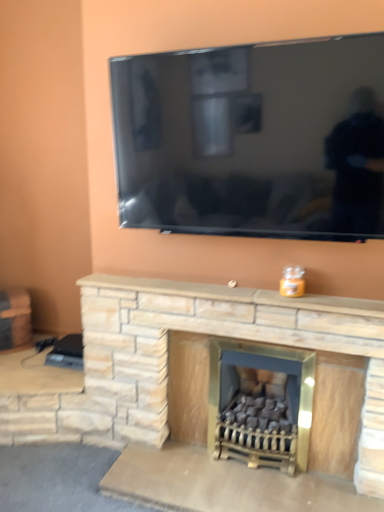
Question: Is brushed metal side table at left far away from natural stone fireplace at center, the 2th fireplace from the right?

Choices:
 (A) yes
 (B) no

Answer: (A)

Question: From the image's perspective, is brushed metal side table at left on top of natural stone fireplace at center, the 2th fireplace from the right?

Choices:
 (A) yes
 (B) no

Answer: (A)

Question: Is the surface of brushed metal side table at left in direct contact with natural stone fireplace at center, the 2th fireplace from the right?

Choices:
 (A) no
 (B) yes

Answer: (A)

Question: Is natural stone fireplace at center, which ranks as the 1th fireplace in left-to-right order, located within brushed metal side table at left?

Choices:
 (A) no
 (B) yes

Answer: (A)

Question: Does brushed metal side table at left have a greater width compared to natural stone fireplace at center, which ranks as the 1th fireplace in left-to-right order?

Choices:
 (A) no
 (B) yes

Answer: (B)

Question: From a real-world perspective, is brushed metal side table at left on top of natural stone fireplace at center, which ranks as the 1th fireplace in left-to-right order?

Choices:
 (A) yes
 (B) no

Answer: (A)

Question: Does natural stone fireplace at center, the 2th fireplace from the right, appear on the right side of matte stone fireplace at center, acting as the second fireplace starting from the left?

Choices:
 (A) yes
 (B) no

Answer: (B)

Question: From a real-world perspective, is natural stone fireplace at center, the 2th fireplace from the right, under matte stone fireplace at center, acting as the second fireplace starting from the left?

Choices:
 (A) yes
 (B) no

Answer: (B)

Question: Is the surface of natural stone fireplace at center, the 2th fireplace from the right, in direct contact with matte stone fireplace at center, acting as the second fireplace starting from the left?

Choices:
 (A) yes
 (B) no

Answer: (B)

Question: Is natural stone fireplace at center, which ranks as the 1th fireplace in left-to-right order, completely or partially outside of matte stone fireplace at center, acting as the second fireplace starting from the left?

Choices:
 (A) no
 (B) yes

Answer: (B)

Question: Is natural stone fireplace at center, the 2th fireplace from the right, aimed at matte stone fireplace at center, acting as the second fireplace starting from the left?

Choices:
 (A) no
 (B) yes

Answer: (B)

Question: Is natural stone fireplace at center, the 2th fireplace from the right, positioned behind matte stone fireplace at center, acting as the second fireplace starting from the left?

Choices:
 (A) no
 (B) yes

Answer: (A)

Question: Can you see matte stone fireplace at center, acting as the second fireplace starting from the left, touching natural stone fireplace at center?

Choices:
 (A) yes
 (B) no

Answer: (B)